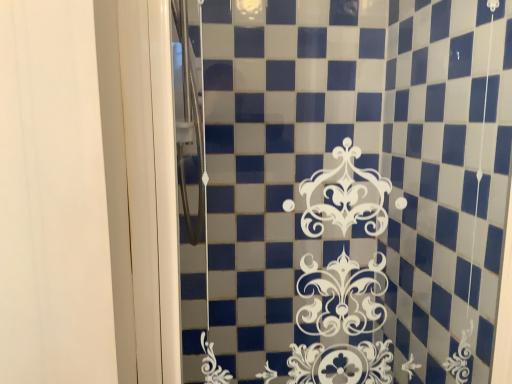
Locate an element on the screen. The image size is (512, 384). transparent glass door at center is located at coordinates (356, 166).

Describe the element at coordinates (356, 166) in the screenshot. This screenshot has height=384, width=512. I see `transparent glass door at center` at that location.

You are a GUI agent. You are given a task and a screenshot of the screen. Output one action in this format:
    pyautogui.click(x=<x>, y=<y>)
    Task: Click on the transparent glass door at center
    
    Given the screenshot: What is the action you would take?
    pyautogui.click(x=356, y=166)